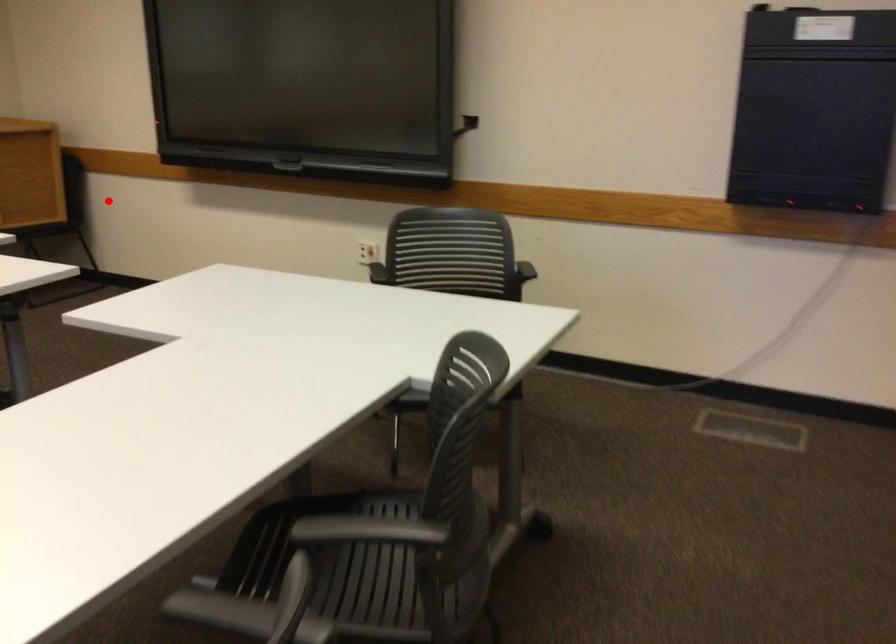
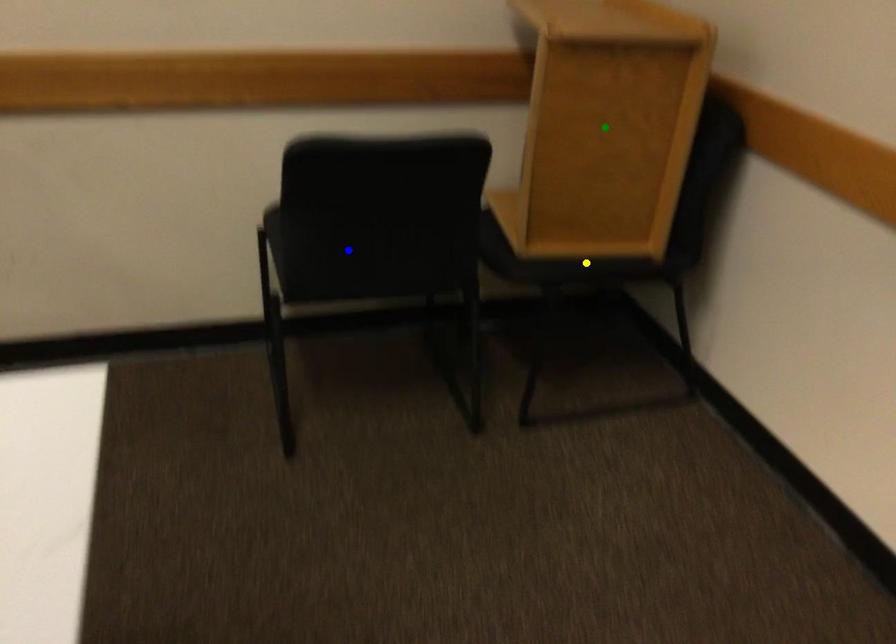
Question: I am providing you with two images of the same scene from different viewpoints. A red point is marked on the first image. You are given multiple points on the second image. Which point in image 2 represents the same 3d spot as the red point in image 1?

Choices:
 (A) green point
 (B) blue point
 (C) yellow point

Answer: (C)